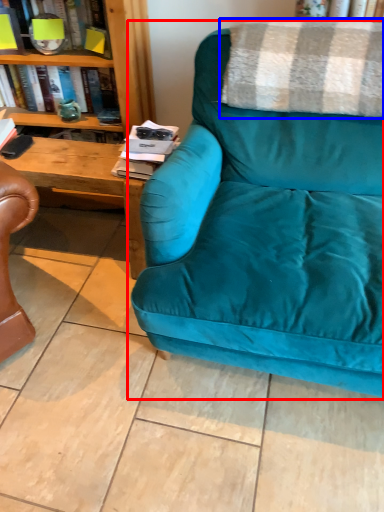
Question: Among these objects, which one is nearest to the camera, studio couch (highlighted by a red box) or blanket (highlighted by a blue box)?

Choices:
 (A) studio couch
 (B) blanket

Answer: (A)